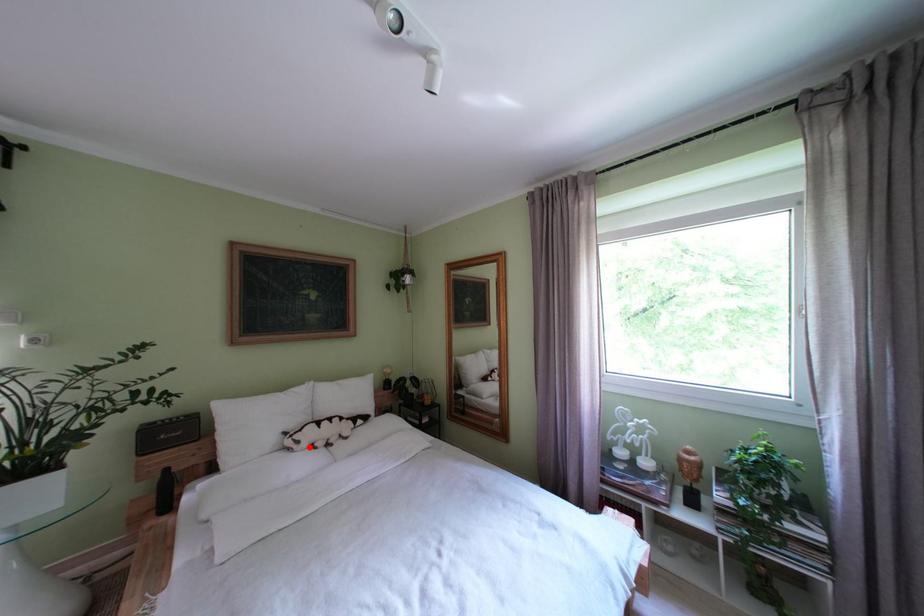
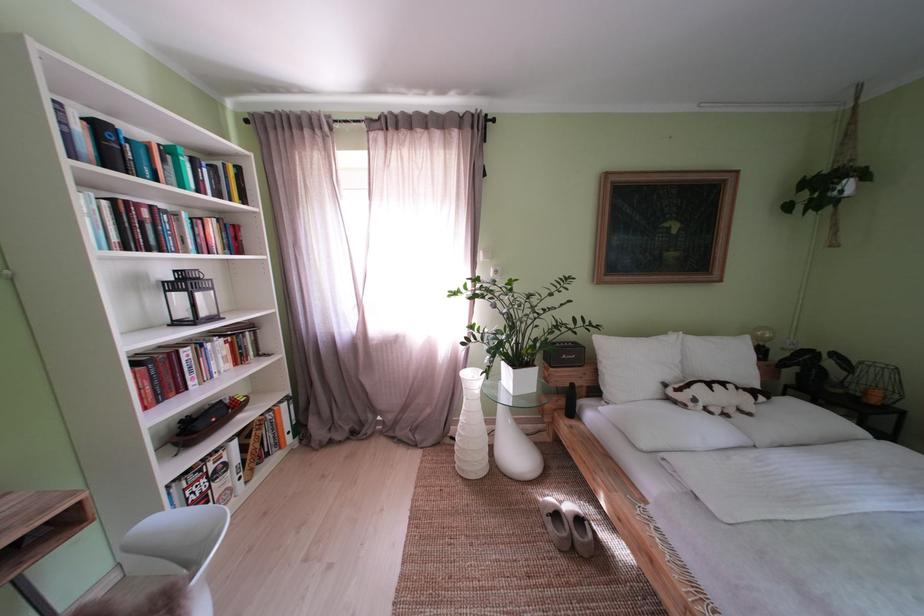
Question: I am providing you with two images of the same scene from different viewpoints. In image1, a red point is highlighted. Considering the same 3D point in image2, which of the following is correct?

Choices:
 (A) It is closer
 (B) It is farther

Answer: (A)